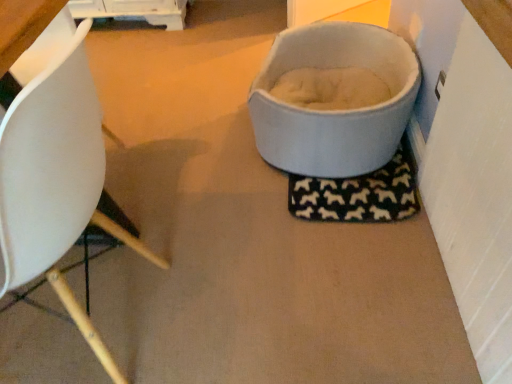
Question: Is light gray fabric pet bed at upper right wider or thinner than white matte chair at left?

Choices:
 (A) thin
 (B) wide

Answer: (B)

Question: Is point (287, 48) positioned closer to the camera than point (69, 145)?

Choices:
 (A) farther
 (B) closer

Answer: (A)

Question: Would you say light gray fabric pet bed at upper right is to the left or to the right of white matte chair at left in the picture?

Choices:
 (A) left
 (B) right

Answer: (B)

Question: Is white matte chair at left wider or thinner than light gray fabric pet bed at upper right?

Choices:
 (A) wide
 (B) thin

Answer: (B)

Question: From the image's perspective, is white matte chair at left above or below light gray fabric pet bed at upper right?

Choices:
 (A) below
 (B) above

Answer: (A)

Question: In terms of size, does white matte chair at left appear bigger or smaller than light gray fabric pet bed at upper right?

Choices:
 (A) small
 (B) big

Answer: (B)

Question: Is white matte chair at left in front of or behind light gray fabric pet bed at upper right in the image?

Choices:
 (A) behind
 (B) front

Answer: (B)